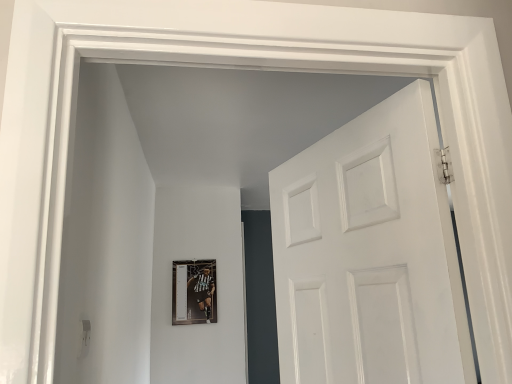
You are a GUI agent. You are given a task and a screenshot of the screen. Output one action in this format:
    pyautogui.click(x=<x>, y=<y>)
    Task: Click on the metallic silver picture frame at lower center
    
    Given the screenshot: What is the action you would take?
    pyautogui.click(x=194, y=292)

Describe the element at coordinates (194, 292) in the screenshot. I see `metallic silver picture frame at lower center` at that location.

Identify the location of metallic silver picture frame at lower center. (194, 292).